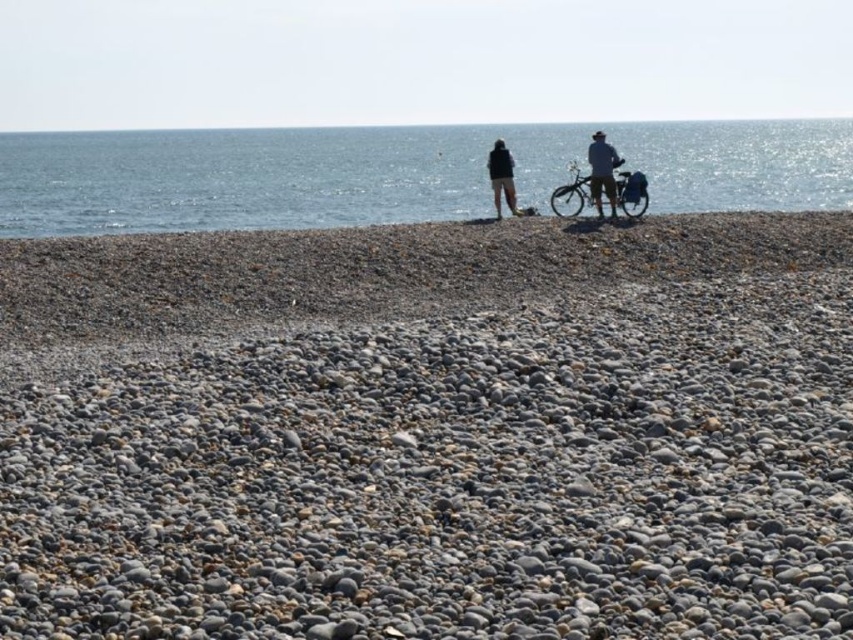
Identify the location of shiny metallic bicycle at right. (572, 195).

I want to click on shiny metallic bicycle at right, so click(x=572, y=195).

Does blue water at upper center appear on the right side of matte black jacket at center?

No, blue water at upper center is not to the right of matte black jacket at center.

Between blue water at upper center and matte black jacket at center, which one has more height?

blue water at upper center is taller.

Who is more forward, (752, 198) or (590, 145)?

Point (590, 145) is in front.

This screenshot has width=853, height=640. In order to click on blue water at upper center in this screenshot , I will do `click(396, 173)`.

Can you confirm if blue water at upper center is thinner than shiny metallic bicycle at right?

No.

Is point (759, 132) closer to viewer compared to point (553, 212)?

No, it is behind (553, 212).

What do you see at coordinates (396, 173) in the screenshot? The width and height of the screenshot is (853, 640). I see `blue water at upper center` at bounding box center [396, 173].

At what (x,y) coordinates should I click in order to perform the action: click on blue water at upper center. Please return your answer as a coordinate pair (x, y). Image resolution: width=853 pixels, height=640 pixels. Looking at the image, I should click on (396, 173).